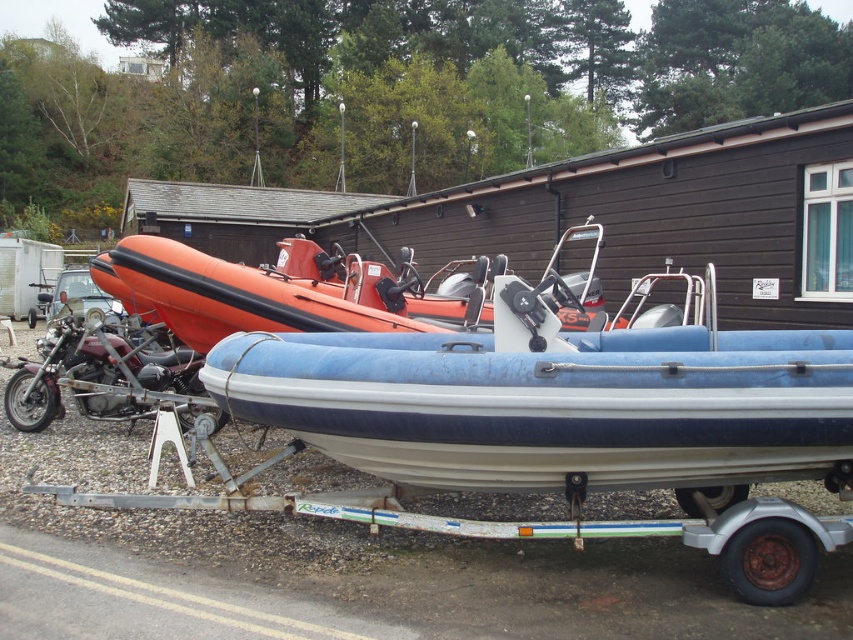
Can you confirm if blue rubber boat at center is wider than shiny chrome motorcycle at left?

Yes, blue rubber boat at center is wider than shiny chrome motorcycle at left.

From the picture: Who is more forward, (444, 440) or (177, 392)?

Point (444, 440) is in front.

Between point (767, 449) and point (15, 417), which one is positioned behind?

The point (15, 417) is behind.

Locate an element on the screen. Image resolution: width=853 pixels, height=640 pixels. blue rubber boat at center is located at coordinates (553, 401).